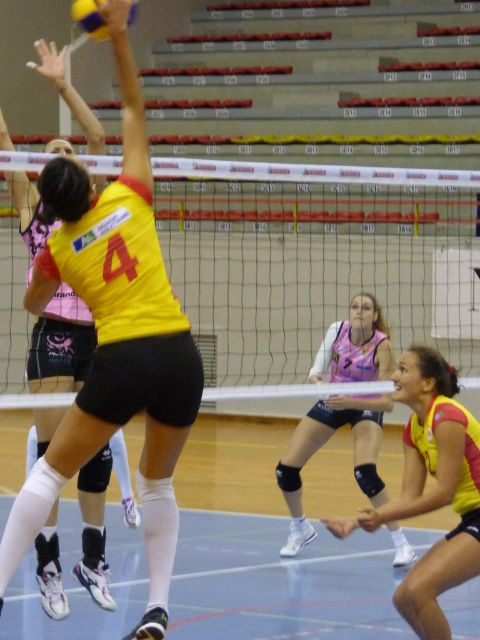
Question: Is yellow matte jersey at center to the left of yellow matte volleyball at upper left from the viewer's perspective?

Choices:
 (A) no
 (B) yes

Answer: (A)

Question: Can you confirm if yellow matte jersey at center is smaller than yellow matte jersey at lower right?

Choices:
 (A) no
 (B) yes

Answer: (A)

Question: Considering the real-world distances, which object is closest to the yellow matte jersey at center?

Choices:
 (A) yellow matte volleyball at upper left
 (B) pink jersey at center
 (C) beige mesh net at center

Answer: (A)

Question: Among these objects, which one is farthest from the camera?

Choices:
 (A) yellow matte jersey at center
 (B) beige mesh net at center

Answer: (B)

Question: Among these objects, which one is nearest to the camera?

Choices:
 (A) yellow matte jersey at lower right
 (B) yellow matte volleyball at upper left

Answer: (B)

Question: Does yellow matte jersey at center have a greater width compared to yellow matte jersey at lower right?

Choices:
 (A) yes
 (B) no

Answer: (A)